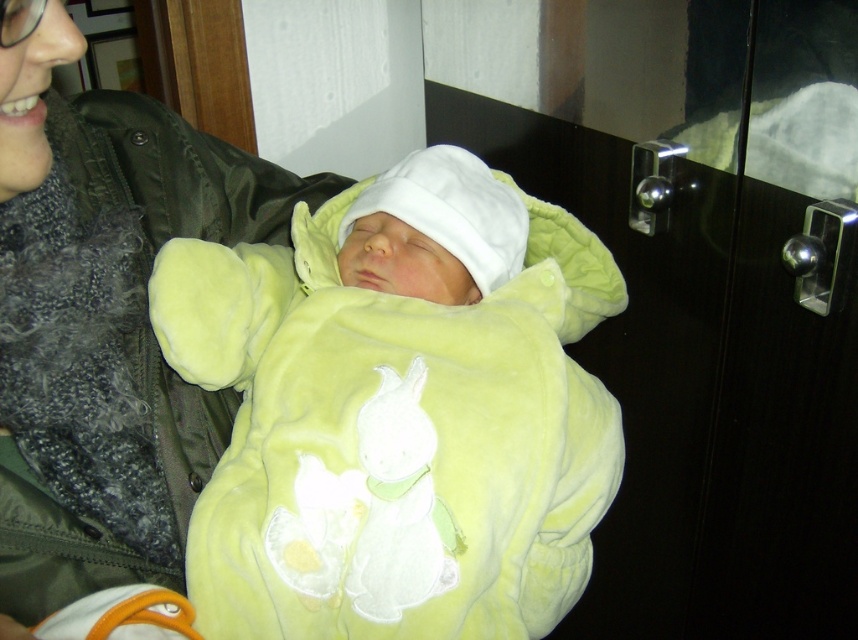
Question: Which object is closer to the camera taking this photo?

Choices:
 (A) velvet green jacket at upper left
 (B) velvety yellow onesie at center

Answer: (A)

Question: Which point is closer to the camera?

Choices:
 (A) (155, 394)
 (B) (429, 275)

Answer: (A)

Question: From the image, what is the correct spatial relationship of velvety yellow onesie at center in relation to velvet green jacket at upper left?

Choices:
 (A) above
 (B) below

Answer: (B)

Question: Is the position of velvety yellow onesie at center less distant than that of velvet green jacket at upper left?

Choices:
 (A) yes
 (B) no

Answer: (B)

Question: Is velvety yellow onesie at center wider than velvet green jacket at upper left?

Choices:
 (A) yes
 (B) no

Answer: (A)